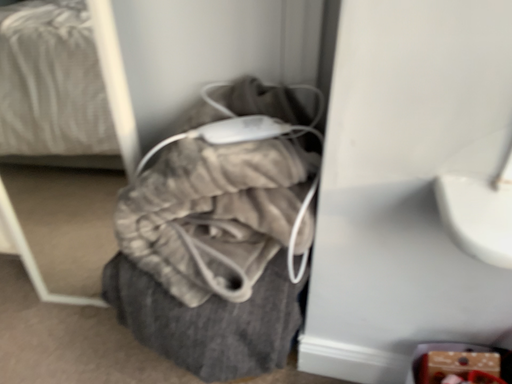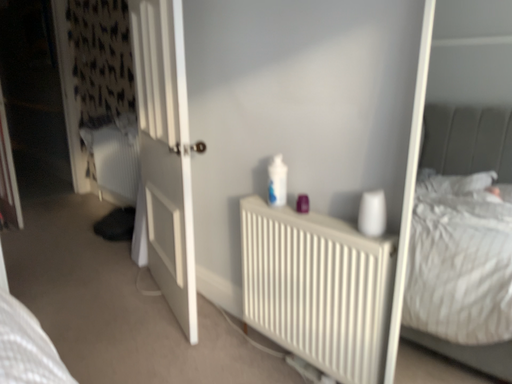
Question: Which way did the camera rotate in the video?

Choices:
 (A) rotated upward
 (B) rotated downward

Answer: (A)